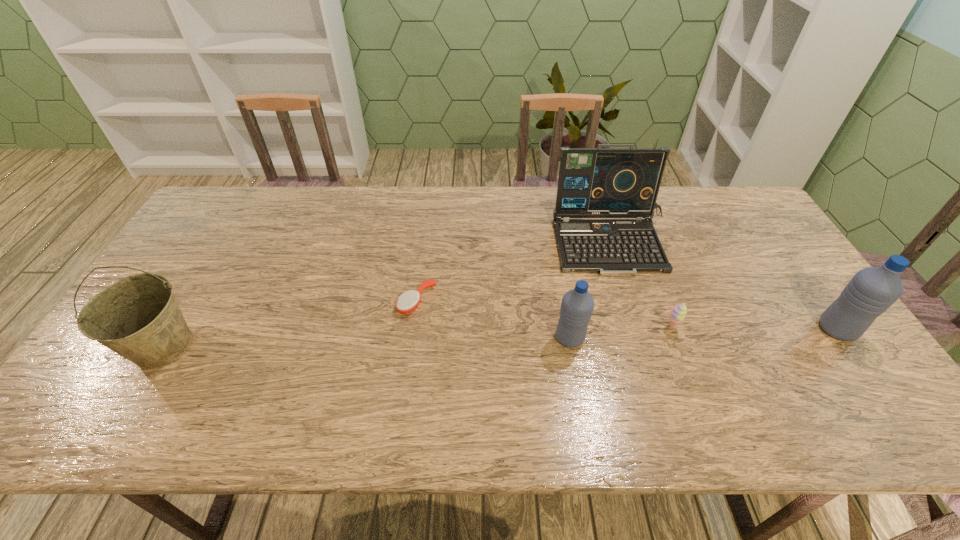
The image size is (960, 540). I want to click on free space located on the back of the right water bottle, so click(813, 296).

Where is `vacant area situated on the front-facing side of the laptop computer`? This screenshot has width=960, height=540. vacant area situated on the front-facing side of the laptop computer is located at coordinates (643, 341).

Find the location of a particular element. This screenshot has height=540, width=960. vacant space located on the left of the second shortest object is located at coordinates (562, 327).

This screenshot has width=960, height=540. Identify the location of vacant area located 0.120m on the left of the hairbrush. (355, 301).

You are a GUI agent. You are given a task and a screenshot of the screen. Output one action in this format:
    pyautogui.click(x=<x>, y=<y>)
    Task: Click on the vacant space located on the back of the leftmost object
    
    Given the screenshot: What is the action you would take?
    pyautogui.click(x=233, y=231)

At what (x,y) coordinates should I click in order to perform the action: click on object that is at the far edge. Please return your answer as a coordinate pair (x, y). Looking at the image, I should click on (598, 182).

The width and height of the screenshot is (960, 540). Identify the location of object at the near edge. (138, 317).

I want to click on object located at the left edge, so click(138, 317).

At what (x,y) coordinates should I click in order to perform the action: click on object located in the right edge section of the desktop. Please return your answer as a coordinate pair (x, y). Looking at the image, I should click on (872, 290).

Find the location of `object that is at the near left corner`. object that is at the near left corner is located at coordinates (138, 317).